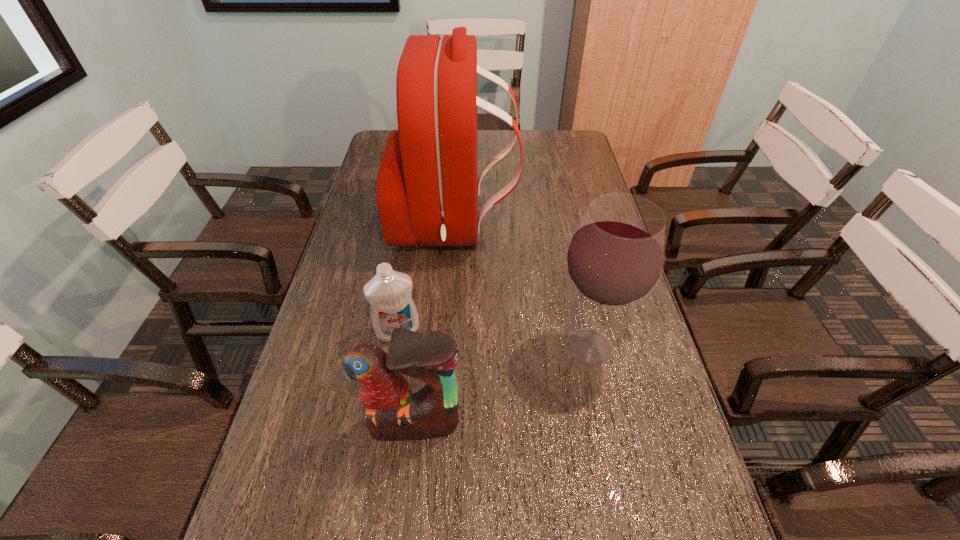
Identify the location of backpack located at the left edge. (427, 189).

This screenshot has height=540, width=960. Find the location of `detergent at the left edge`. detergent at the left edge is located at coordinates (389, 292).

Identify the location of object located at the right edge. (615, 258).

Identify the location of free space at the left edge of the desktop. This screenshot has height=540, width=960. (354, 343).

I want to click on free space at the right edge of the desktop, so click(x=682, y=444).

Where is `blank space at the far right corner of the desktop`? blank space at the far right corner of the desktop is located at coordinates (570, 130).

You are a GUI agent. You are given a task and a screenshot of the screen. Output one action in this format:
    pyautogui.click(x=<x>, y=<y>)
    Task: Click on the unoccupied position between the parrot and the farthest object
    This screenshot has width=960, height=540.
    Given the screenshot: What is the action you would take?
    pyautogui.click(x=434, y=324)

Identify the location of free space between the backpack and the shortest object. The height and width of the screenshot is (540, 960). [x=426, y=278].

What are the coordinates of `empty space that is in between the backpack and the alcohol` in the screenshot? It's located at (522, 286).

Locate an element on the screen. This screenshot has width=960, height=540. vacant point located between the rightmost object and the tallest object is located at coordinates (522, 286).